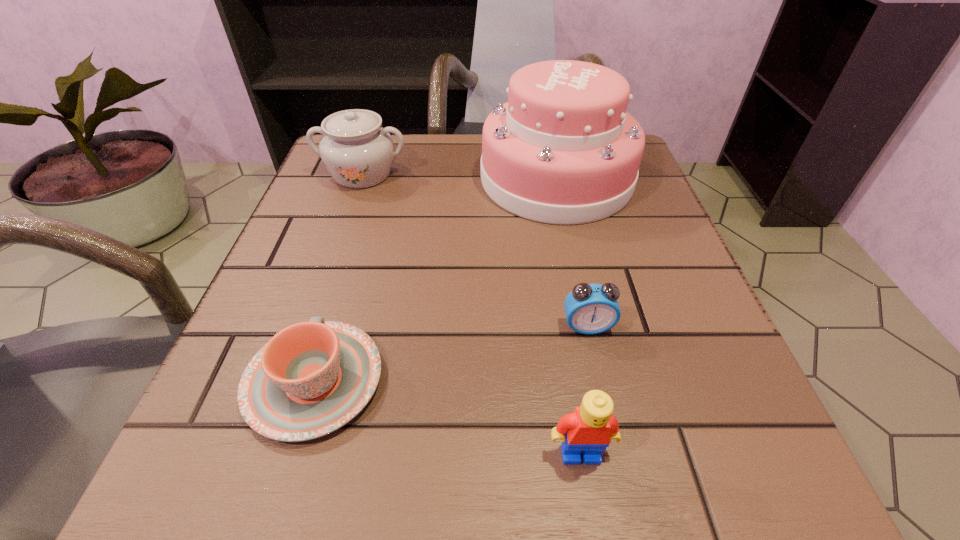
Find the location of a particular element. object present at the far right corner is located at coordinates (563, 150).

In the image, there is a desktop. Find the location of `vacant region at the far edge`. vacant region at the far edge is located at coordinates (476, 159).

In the image, there is a desktop. What are the coordinates of `vacant space at the near edge` in the screenshot? It's located at (360, 461).

Identify the location of vacant space at the left edge of the desktop. (226, 420).

The width and height of the screenshot is (960, 540). I want to click on vacant space at the right edge of the desktop, so click(588, 254).

Identify the location of vacant space at the far left corner of the desktop. (326, 172).

The width and height of the screenshot is (960, 540). Identify the location of blank space at the near left corner of the desktop. (307, 456).

At what (x,y) coordinates should I click in order to perform the action: click on vacant space at the near right corner. Please return your answer as a coordinate pair (x, y). The height and width of the screenshot is (540, 960). Looking at the image, I should click on (775, 452).

Where is `free space between the Lego and the taller chinaware`? This screenshot has width=960, height=540. free space between the Lego and the taller chinaware is located at coordinates (471, 314).

At what (x,y) coordinates should I click in order to perform the action: click on vacant area that lies between the alarm clock and the shorter chinaware. Please return your answer as a coordinate pair (x, y). Looking at the image, I should click on (451, 354).